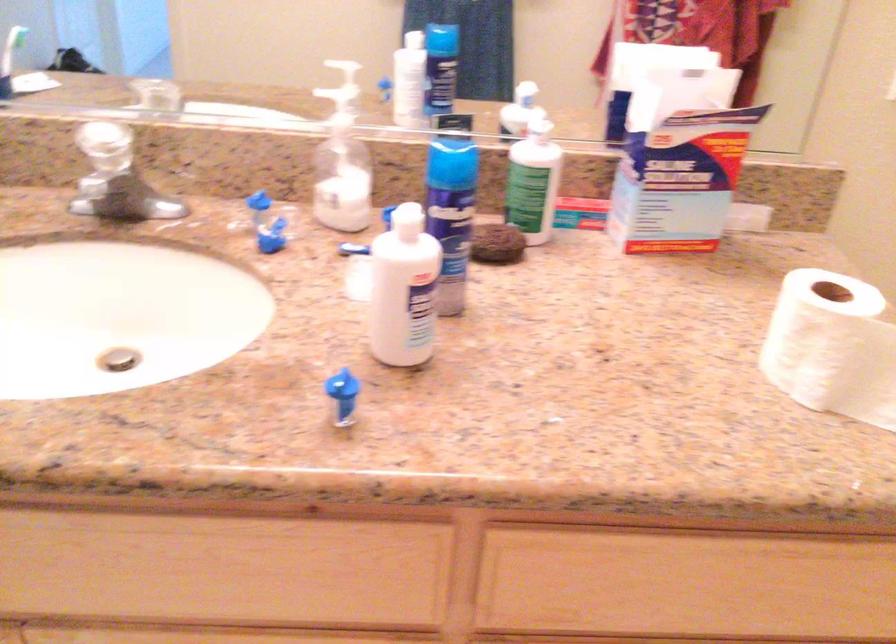
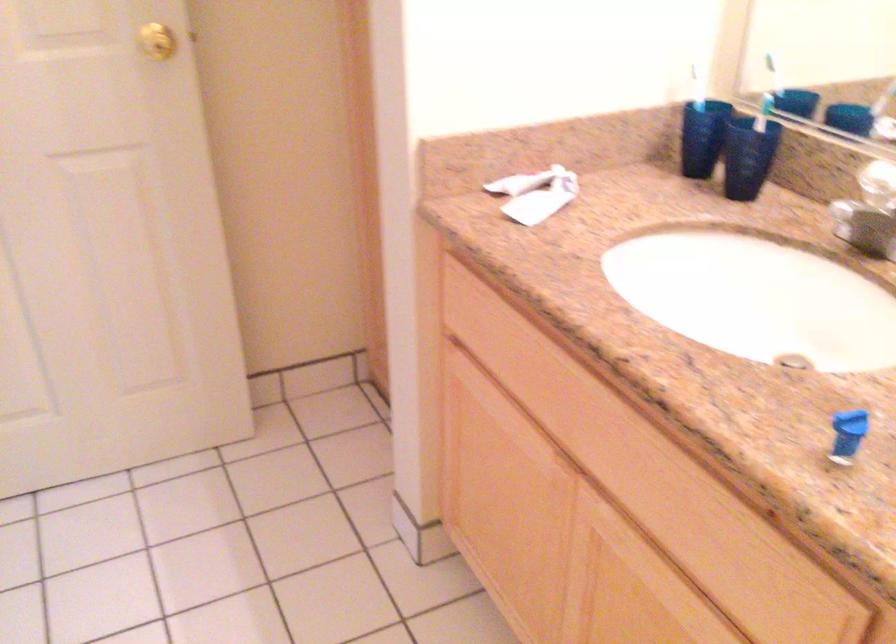
Question: Based on the continuous images, in which direction is the camera rotating? Reply with the corresponding letter.

Choices:
 (A) Left
 (B) Right
 (C) Up
 (D) Down

Answer: (A)